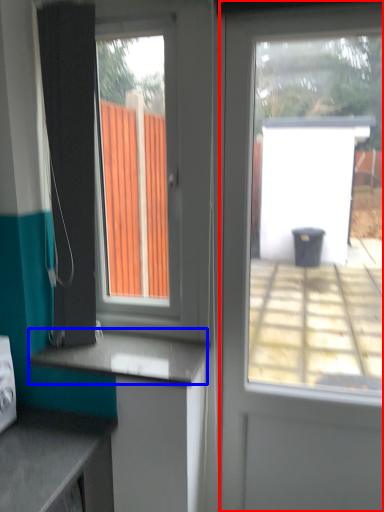
Question: Among these objects, which one is farthest to the camera, door (highlighted by a red box) or counter top (highlighted by a blue box)?

Choices:
 (A) door
 (B) counter top

Answer: (B)